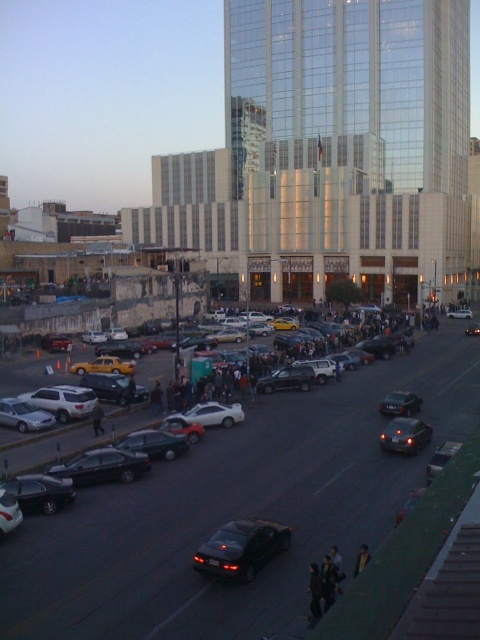
You are a pedestrian trying to cross the street and see both the silver metallic sedan at lower left and the yellow matte taxi cab at lower left. Which vehicle is closer to the left side of the road?

The yellow matte taxi cab at lower left is closer to the left side of the road because the silver metallic sedan at lower left is positioned to its right.

You are standing at the point labeled point (396, 449) and want to walk towards the point labeled point (403, 406). Which direction should you face to move directly towards it?

You should face towards the upper left direction because point (403, 406) is further away from the camera compared to point (396, 449), so moving towards it would require going away from the camera, which corresponds to the upper left direction in the image.